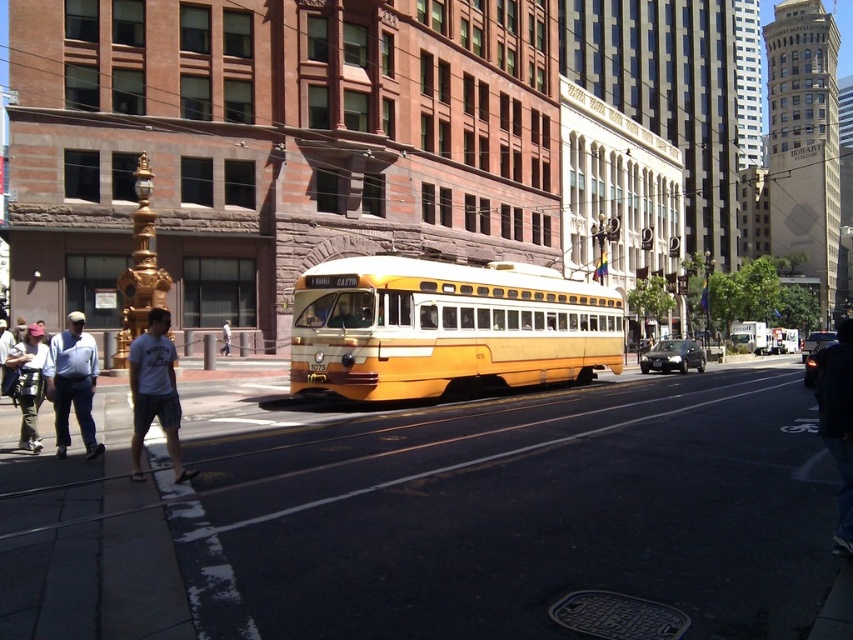
You are standing at the point with coordinates point (45, 353) and want to walk to the tram 1075 Castro. Which direction should you move relative to the point (91, 440)?

You should move forward towards the point (91, 440) because it is in front of your current position at point (45, 353).

You are standing at the point with coordinates (445,326) in the image. What object are you currently standing on?

You are standing on the yellow matte satin school bus at center.